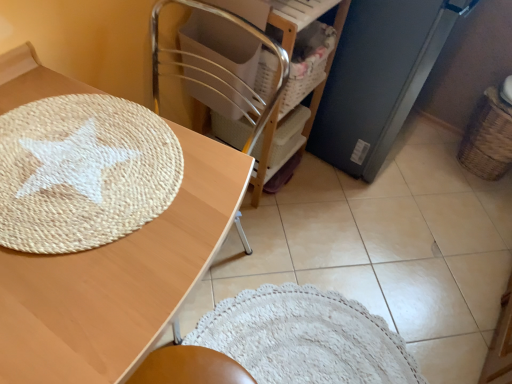
Image resolution: width=512 pixels, height=384 pixels. I want to click on free space in front of woven brown basket at right, so click(477, 199).